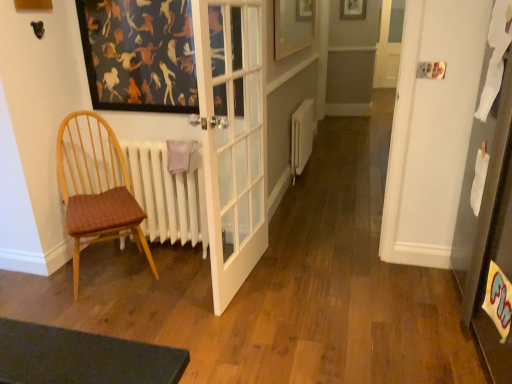
Question: From the image's perspective, is woven fabric chair at left located above white matte radiator at left?

Choices:
 (A) yes
 (B) no

Answer: (B)

Question: Considering the relative sizes of woven fabric chair at left and white matte radiator at left in the image provided, is woven fabric chair at left taller than white matte radiator at left?

Choices:
 (A) yes
 (B) no

Answer: (A)

Question: Is woven fabric chair at left thinner than white matte radiator at left?

Choices:
 (A) no
 (B) yes

Answer: (A)

Question: From a real-world perspective, is woven fabric chair at left over white matte radiator at left?

Choices:
 (A) yes
 (B) no

Answer: (A)

Question: Would you say woven fabric chair at left is outside white matte radiator at left?

Choices:
 (A) no
 (B) yes

Answer: (B)

Question: Is white matte radiator at left in front of or behind wooden picture frame at upper center, which is the 1th picture frame in bottom-to-top order, in the image?

Choices:
 (A) behind
 (B) front

Answer: (B)

Question: Do you think white matte radiator at left is within wooden picture frame at upper center, placed as the second picture frame when sorted from right to left, or outside of it?

Choices:
 (A) inside
 (B) outside

Answer: (B)

Question: Considering the relative positions of white matte radiator at left and wooden picture frame at upper center, the 2th picture frame when ordered from top to bottom, in the image provided, is white matte radiator at left to the left or to the right of wooden picture frame at upper center, the 2th picture frame when ordered from top to bottom,?

Choices:
 (A) right
 (B) left

Answer: (B)

Question: From a real-world perspective, is white matte radiator at left physically located above or below wooden picture frame at upper center, which ranks as the first picture frame in front-to-back order?

Choices:
 (A) above
 (B) below

Answer: (B)

Question: From the image's perspective, relative to wooden picture frame at upper center, arranged as the second picture frame when ordered from the bottom, is white matte radiator at left above or below?

Choices:
 (A) below
 (B) above

Answer: (A)

Question: In the image, is white matte radiator at left positioned in front of or behind wooden picture frame at upper center, positioned as the 2th picture frame in left-to-right order?

Choices:
 (A) front
 (B) behind

Answer: (A)

Question: From a real-world perspective, is white matte radiator at left positioned above or below wooden picture frame at upper center, the 1th picture frame viewed from the right?

Choices:
 (A) above
 (B) below

Answer: (B)

Question: Do you think white matte radiator at left is within wooden picture frame at upper center, the 1th picture frame viewed from the right, or outside of it?

Choices:
 (A) inside
 (B) outside

Answer: (B)

Question: Considering the positions of woven fabric chair at left and wooden picture frame at upper center, which ranks as the first picture frame in front-to-back order, in the image, is woven fabric chair at left wider or thinner than wooden picture frame at upper center, which ranks as the first picture frame in front-to-back order,?

Choices:
 (A) wide
 (B) thin

Answer: (A)

Question: In terms of size, does woven fabric chair at left appear bigger or smaller than wooden picture frame at upper center, which is the 1th picture frame in bottom-to-top order?

Choices:
 (A) small
 (B) big

Answer: (B)